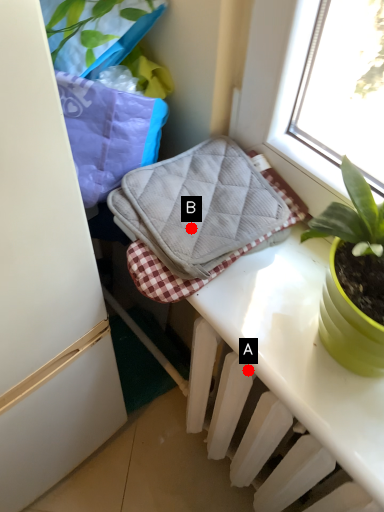
Question: Two points are circled on the image, labeled by A and B beside each circle. Which point is closer to the camera?

Choices:
 (A) A is closer
 (B) B is closer

Answer: (B)